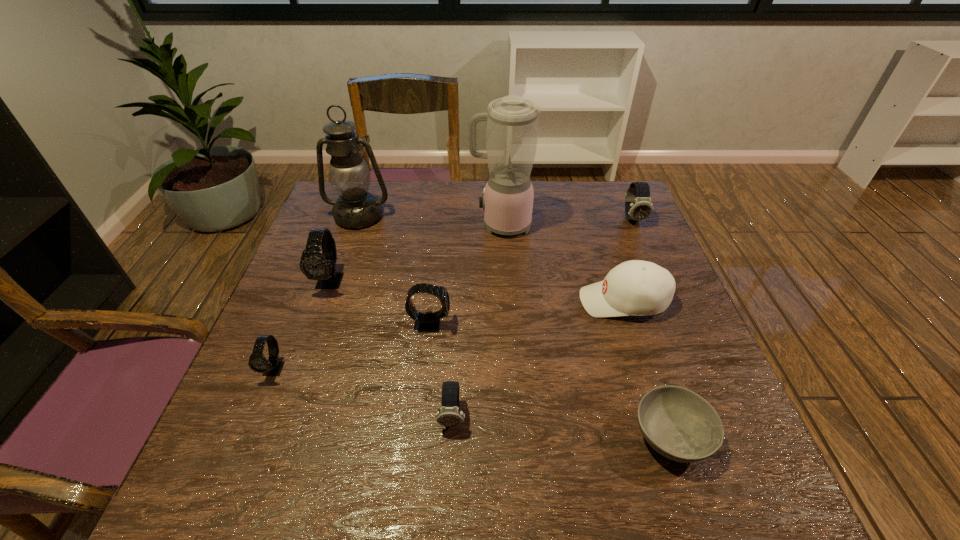
The width and height of the screenshot is (960, 540). I want to click on unoccupied area between the farther dark watch and the nearest gray watch, so click(x=454, y=294).

Identify the location of vacant area between the farthest gray watch and the food processor. The height and width of the screenshot is (540, 960). (416, 253).

The image size is (960, 540). I want to click on free space between the third farthest watch and the baseball cap, so click(x=527, y=313).

You are a GUI agent. You are given a task and a screenshot of the screen. Output one action in this format:
    pyautogui.click(x=<x>, y=<y>)
    Task: Click on the closest object to the food processor
    The width and height of the screenshot is (960, 540).
    Given the screenshot: What is the action you would take?
    (636, 287)

Identify which object is located as the nearest to the smaller dark watch. Please provide its 2D coordinates. Your answer should be formatted as a tuple, i.e. [(x, y)], where the tuple contains the x and y coordinates of a point satisfying the conditions above.

[(429, 322)]

Identify which watch is the fifth nearest to the shortest object. Please provide its 2D coordinates. Your answer should be formatted as a tuple, i.e. [(x, y)], where the tuple contains the x and y coordinates of a point satisfying the conditions above.

[(258, 363)]

Identify which watch is the second closest to the oil lamp. Please provide its 2D coordinates. Your answer should be formatted as a tuple, i.e. [(x, y)], where the tuple contains the x and y coordinates of a point satisfying the conditions above.

[(429, 322)]

Select which gray watch appears as the second closest to the baseball cap. Please provide its 2D coordinates. Your answer should be formatted as a tuple, i.e. [(x, y)], where the tuple contains the x and y coordinates of a point satisfying the conditions above.

[(315, 264)]

Identify which gray watch is the nearest to the nearest gray watch. Please provide its 2D coordinates. Your answer should be formatted as a tuple, i.e. [(x, y)], where the tuple contains the x and y coordinates of a point satisfying the conditions above.

[(315, 264)]

Where is `free region that satisfies the following two spatial constraints: 1. on the face of the bowl; 2. on the left side of the nearer dark watch`? This screenshot has width=960, height=540. free region that satisfies the following two spatial constraints: 1. on the face of the bowl; 2. on the left side of the nearer dark watch is located at coordinates (451, 435).